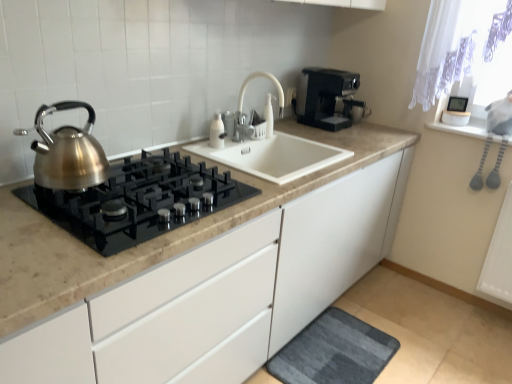
Identify the location of vacant area on top of dark gray textured bath mat at lower center (from a real-world perspective). click(337, 349).